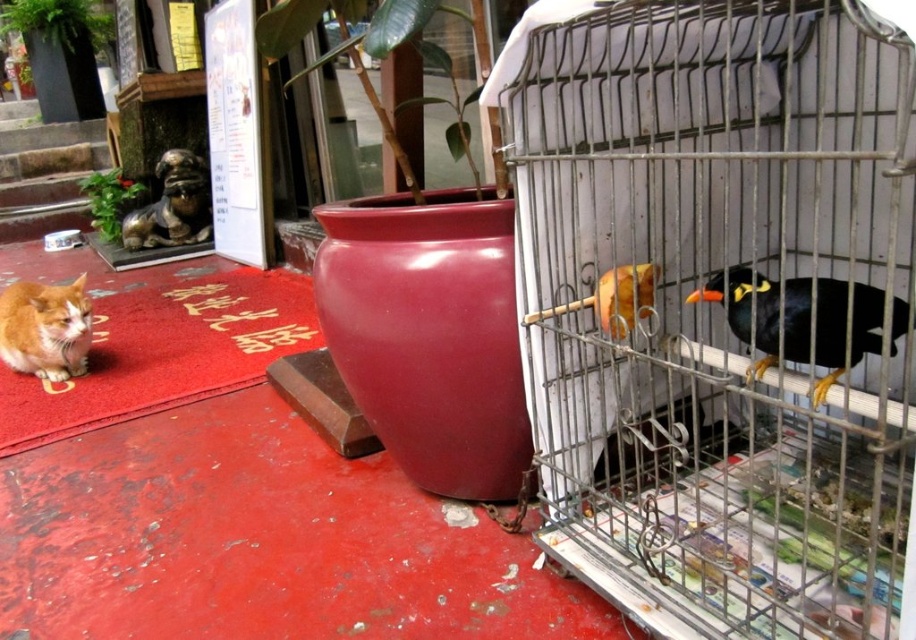
Question: Does black glossy bird at right have a smaller size compared to orange fur cat at left?

Choices:
 (A) no
 (B) yes

Answer: (B)

Question: Among these objects, which one is farthest from the camera?

Choices:
 (A) orange fur cat at left
 (B) metallic wire birdcage at right
 (C) black glossy bird at right

Answer: (A)

Question: Which object is positioned farthest from the orange fur cat at left?

Choices:
 (A) metallic wire birdcage at right
 (B) black glossy bird at right

Answer: (B)

Question: Which object appears farthest from the camera in this image?

Choices:
 (A) metallic wire birdcage at right
 (B) black glossy bird at right
 (C) orange fur cat at left

Answer: (C)

Question: Is metallic wire birdcage at right thinner than orange fur cat at left?

Choices:
 (A) yes
 (B) no

Answer: (B)

Question: Considering the relative positions of metallic wire birdcage at right and black glossy bird at right in the image provided, where is metallic wire birdcage at right located with respect to black glossy bird at right?

Choices:
 (A) left
 (B) right

Answer: (A)